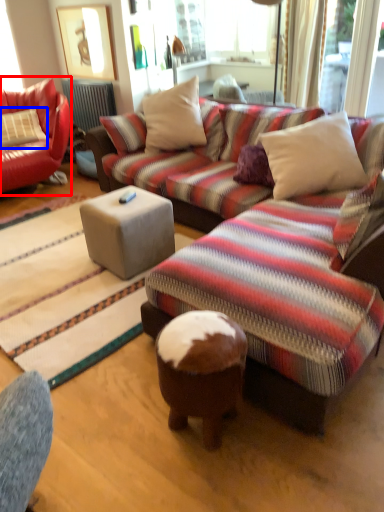
Question: Which object appears closest to the camera in this image, studio couch (highlighted by a red box) or pillow (highlighted by a blue box)?

Choices:
 (A) studio couch
 (B) pillow

Answer: (A)